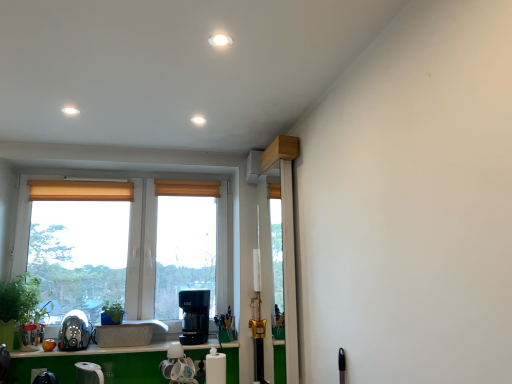
Question: Considering the relative sizes of green matte plant at left, the first plant viewed from the left, and white matte sink at lower center in the image provided, is green matte plant at left, the first plant viewed from the left, taller than white matte sink at lower center?

Choices:
 (A) no
 (B) yes

Answer: (B)

Question: Considering the relative sizes of green matte plant at left, the second plant viewed from the right, and white matte sink at lower center in the image provided, is green matte plant at left, the second plant viewed from the right, smaller than white matte sink at lower center?

Choices:
 (A) no
 (B) yes

Answer: (A)

Question: From the image's perspective, is green matte plant at left, the second plant viewed from the right, above white matte sink at lower center?

Choices:
 (A) no
 (B) yes

Answer: (B)

Question: Can you confirm if green matte plant at left, the second plant viewed from the right, is thinner than white matte sink at lower center?

Choices:
 (A) no
 (B) yes

Answer: (B)

Question: Could you tell me if green matte plant at left, the second plant viewed from the right, is turned towards white matte sink at lower center?

Choices:
 (A) yes
 (B) no

Answer: (B)

Question: From the image's perspective, relative to green matte plant at left, the first plant viewed from the left, is clear plastic screen door at center above or below?

Choices:
 (A) above
 (B) below

Answer: (A)

Question: Would you say clear plastic screen door at center is to the left or to the right of green matte plant at left, the second plant viewed from the right, in the picture?

Choices:
 (A) right
 (B) left

Answer: (A)

Question: Is clear plastic screen door at center inside or outside of green matte plant at left, the first plant viewed from the left?

Choices:
 (A) inside
 (B) outside

Answer: (B)

Question: Relative to green matte plant at left, the second plant viewed from the right, is clear plastic screen door at center in front or behind?

Choices:
 (A) behind
 (B) front

Answer: (B)

Question: Is satin silver coffee machine at lower left, which appears as the second coffee machine when viewed from the right, bigger or smaller than white glossy paper towel holder at center, positioned as the 2th appliance in left-to-right order?

Choices:
 (A) big
 (B) small

Answer: (A)

Question: From a real-world perspective, relative to white glossy paper towel holder at center, which appears as the first appliance when viewed from the right, is satin silver coffee machine at lower left, which appears as the second coffee machine when viewed from the right, vertically above or below?

Choices:
 (A) above
 (B) below

Answer: (A)

Question: Is satin silver coffee machine at lower left, which appears as the second coffee machine when viewed from the right, inside the boundaries of white glossy paper towel holder at center, which appears as the first appliance when viewed from the right, or outside?

Choices:
 (A) outside
 (B) inside

Answer: (A)

Question: Visually, is satin silver coffee machine at lower left, positioned as the first coffee machine in left-to-right order, positioned to the left or to the right of white glossy paper towel holder at center, which appears as the first appliance when viewed from the right?

Choices:
 (A) right
 (B) left

Answer: (B)

Question: From a real-world perspective, is black plastic coffee machine at lower center, which is counted as the 1th coffee machine, starting from the right, positioned above or below matte glass window at center?

Choices:
 (A) above
 (B) below

Answer: (B)

Question: Would you say black plastic coffee machine at lower center, which is counted as the 1th coffee machine, starting from the right, is inside or outside matte glass window at center?

Choices:
 (A) inside
 (B) outside

Answer: (B)